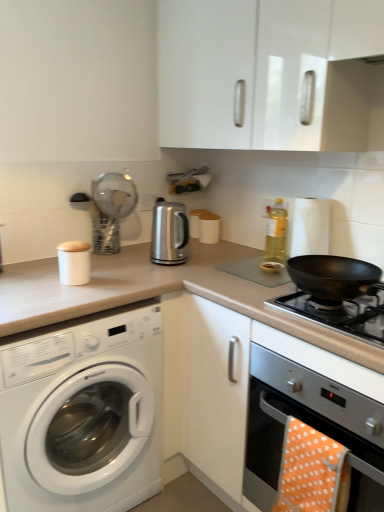
Question: Is white glossy washing machine at left positioned with its back to glossy white cabinet at upper center?

Choices:
 (A) no
 (B) yes

Answer: (A)

Question: Does white glossy washing machine at left have a greater height compared to glossy white cabinet at upper center?

Choices:
 (A) yes
 (B) no

Answer: (A)

Question: Does white glossy washing machine at left appear on the right side of glossy white cabinet at upper center?

Choices:
 (A) no
 (B) yes

Answer: (A)

Question: Are white glossy washing machine at left and glossy white cabinet at upper center located far from each other?

Choices:
 (A) yes
 (B) no

Answer: (A)

Question: Can you confirm if white glossy washing machine at left is smaller than glossy white cabinet at upper center?

Choices:
 (A) no
 (B) yes

Answer: (A)

Question: Does white glossy washing machine at left have a lesser width compared to glossy white cabinet at upper center?

Choices:
 (A) no
 (B) yes

Answer: (A)

Question: Considering the relative sizes of glossy white cabinet at upper center and black matte pan at right in the image provided, is glossy white cabinet at upper center wider than black matte pan at right?

Choices:
 (A) no
 (B) yes

Answer: (A)

Question: Is glossy white cabinet at upper center turned away from black matte pan at right?

Choices:
 (A) no
 (B) yes

Answer: (A)

Question: Can you confirm if glossy white cabinet at upper center is taller than black matte pan at right?

Choices:
 (A) yes
 (B) no

Answer: (A)

Question: Is glossy white cabinet at upper center not within black matte pan at right?

Choices:
 (A) no
 (B) yes

Answer: (B)

Question: Does glossy white cabinet at upper center contain black matte pan at right?

Choices:
 (A) yes
 (B) no

Answer: (B)

Question: From the image's perspective, would you say glossy white cabinet at upper center is positioned over black matte pan at right?

Choices:
 (A) yes
 (B) no

Answer: (A)

Question: Is satin silver oven at lower right closer to camera compared to yellow translucent bottle at upper right?

Choices:
 (A) no
 (B) yes

Answer: (B)